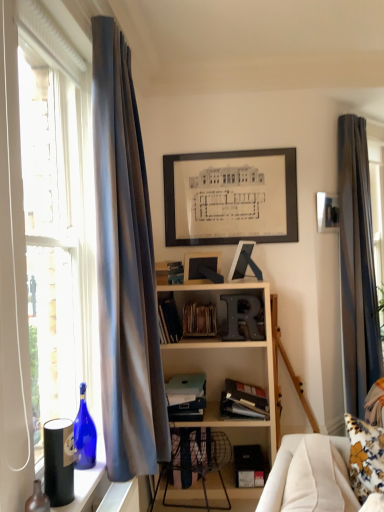
What do you see at coordinates (169, 272) in the screenshot?
I see `matte blue book at center, the 5th book ordered from the bottom` at bounding box center [169, 272].

Describe the element at coordinates (168, 321) in the screenshot. I see `hardcover book at center, which is counted as the 3th book, starting from the top` at that location.

The image size is (384, 512). I want to click on hardcover book at center, the 2th book from the bottom, so click(244, 400).

The height and width of the screenshot is (512, 384). Describe the element at coordinates (244, 400) in the screenshot. I see `hardcover book at center, the 2th book from the bottom` at that location.

Find the location of a particular element. This screenshot has width=384, height=512. matte black book at center, the fifth book positioned from the top is located at coordinates pos(186,397).

You are a GUI agent. You are given a task and a screenshot of the screen. Output one action in this format:
    pyautogui.click(x=<x>, y=<y>)
    Task: Click on the matte glass bottle at lower left, the 1th bottle positioned from the front
    The width and height of the screenshot is (384, 512).
    Given the screenshot: What is the action you would take?
    pyautogui.click(x=37, y=500)

From a real-world perspective, between satin blue curtain at left, which is counted as the second curtain, starting from the right, and wooden spines at center, which ranks as the second book in top-to-bottom order, who is vertically higher?

satin blue curtain at left, which is counted as the second curtain, starting from the right, from a real-world perspective.

Does satin blue curtain at left, the first curtain when ordered from front to back, have a greater height compared to wooden spines at center, placed as the 4th book when sorted from bottom to top?

Yes, satin blue curtain at left, the first curtain when ordered from front to back, is taller than wooden spines at center, placed as the 4th book when sorted from bottom to top.

From the image's perspective, relative to wooden spines at center, which ranks as the second book in top-to-bottom order, is satin blue curtain at left, the first curtain when ordered from front to back, above or below?

From the image's perspective, satin blue curtain at left, the first curtain when ordered from front to back, appears above wooden spines at center, which ranks as the second book in top-to-bottom order.

Is satin blue curtain at left, which is counted as the second curtain, starting from the back, facing towards wooden spines at center, which ranks as the second book in top-to-bottom order?

No, satin blue curtain at left, which is counted as the second curtain, starting from the back, is not aimed at wooden spines at center, which ranks as the second book in top-to-bottom order.

Considering the relative positions of hardcover book at center, the 2th book from the bottom, and matte blue book at center, the 5th book ordered from the bottom, in the image provided, is hardcover book at center, the 2th book from the bottom, to the left or to the right of matte blue book at center, the 5th book ordered from the bottom,?

Based on their positions, hardcover book at center, the 2th book from the bottom, is located to the right of matte blue book at center, the 5th book ordered from the bottom.

Consider the image. What's the angular difference between hardcover book at center, acting as the fourth book starting from the top, and matte blue book at center, the 1th book from the top,'s facing directions?

There is a 51-degree angle between the facing directions of hardcover book at center, acting as the fourth book starting from the top, and matte blue book at center, the 1th book from the top.

Would you say hardcover book at center, acting as the fourth book starting from the top, is inside or outside matte blue book at center, the 1th book from the top?

The correct answer is: outside.

Which is nearer, [262,411] or [176,274]?

The point [262,411] is more forward.

Considering the relative positions of hardcover book at center, the 3th book from the bottom, and silky blue curtain at right, acting as the first curtain starting from the back, in the image provided, is hardcover book at center, the 3th book from the bottom, to the right of silky blue curtain at right, acting as the first curtain starting from the back, from the viewer's perspective?

Incorrect, hardcover book at center, the 3th book from the bottom, is not on the right side of silky blue curtain at right, acting as the first curtain starting from the back.

Is hardcover book at center, which is counted as the 3th book, starting from the top, far from silky blue curtain at right, which is counted as the second curtain, starting from the left?

Yes, hardcover book at center, which is counted as the 3th book, starting from the top, and silky blue curtain at right, which is counted as the second curtain, starting from the left, are located far from each other.

From the image's perspective, which is below, hardcover book at center, the 3th book from the bottom, or silky blue curtain at right, which is counted as the second curtain, starting from the left?

hardcover book at center, the 3th book from the bottom, appears lower in the image.

How far apart are hardcover book at center, the 3th book from the bottom, and silky blue curtain at right, acting as the 1th curtain starting from the right?

The distance of hardcover book at center, the 3th book from the bottom, from silky blue curtain at right, acting as the 1th curtain starting from the right, is 4.94 feet.

Would you say matte black picture frame at center, positioned as the 3th picture frame in back-to-front order, is to the left or to the right of satin blue curtain at left, which is counted as the second curtain, starting from the right, in the picture?

Based on their positions, matte black picture frame at center, positioned as the 3th picture frame in back-to-front order, is located to the right of satin blue curtain at left, which is counted as the second curtain, starting from the right.

Based on their sizes in the image, would you say matte black picture frame at center, arranged as the third picture frame when viewed from the right, is bigger or smaller than satin blue curtain at left, which is counted as the second curtain, starting from the right?

matte black picture frame at center, arranged as the third picture frame when viewed from the right, is smaller than satin blue curtain at left, which is counted as the second curtain, starting from the right.

Considering the relative positions of matte black picture frame at center, which is the first picture frame in front-to-back order, and satin blue curtain at left, which is counted as the second curtain, starting from the back, in the image provided, is matte black picture frame at center, which is the first picture frame in front-to-back order, behind satin blue curtain at left, which is counted as the second curtain, starting from the back,?

Yes, matte black picture frame at center, which is the first picture frame in front-to-back order, is further from the camera.

From a real-world perspective, which is physically below, matte black picture frame at center, positioned as the 3th picture frame in back-to-front order, or satin blue curtain at left, which is counted as the second curtain, starting from the back?

matte black picture frame at center, positioned as the 3th picture frame in back-to-front order, is physically lower.

Would you say matte glass bottle at lower left, which appears as the 2th bottle when viewed from the back, is a long distance from satin blue curtain at left, which is counted as the second curtain, starting from the right?

No, matte glass bottle at lower left, which appears as the 2th bottle when viewed from the back, is not far from satin blue curtain at left, which is counted as the second curtain, starting from the right.

Is point (26, 506) closer to viewer compared to point (114, 175)?

Yes.

From the image's perspective, which is below, matte glass bottle at lower left, which appears as the 2th bottle when viewed from the back, or satin blue curtain at left, which is counted as the second curtain, starting from the right?

matte glass bottle at lower left, which appears as the 2th bottle when viewed from the back.

Which of these two, matte silver picture frame at upper right, the 3th picture frame from the bottom, or hardcover book at center, the 2th book from the bottom, is thinner?

matte silver picture frame at upper right, the 3th picture frame from the bottom.

Which of these two, matte silver picture frame at upper right, the 3th picture frame from the bottom, or hardcover book at center, acting as the fourth book starting from the top, stands shorter?

Standing shorter between the two is hardcover book at center, acting as the fourth book starting from the top.

Consider the image. From a real-world perspective, is matte silver picture frame at upper right, the 3th picture frame viewed from the front, over hardcover book at center, acting as the fourth book starting from the top?

Indeed, from a real-world perspective, matte silver picture frame at upper right, the 3th picture frame viewed from the front, stands above hardcover book at center, acting as the fourth book starting from the top.

Locate an element on the screen. the 5th book in front of the matte silver picture frame at upper right, the 3th picture frame viewed from the left, starting your count from the anchor is located at coordinates (244, 400).

Is matte black book at center, the fifth book positioned from the top, a part of silky blue curtain at right, which is counted as the second curtain, starting from the left?

No, matte black book at center, the fifth book positioned from the top, is not a part of silky blue curtain at right, which is counted as the second curtain, starting from the left.

Between silky blue curtain at right, acting as the first curtain starting from the back, and matte black book at center, marked as the 1th book in a bottom-to-top arrangement, which one has smaller size?

Smaller between the two is matte black book at center, marked as the 1th book in a bottom-to-top arrangement.

Does silky blue curtain at right, acting as the 1th curtain starting from the right, have a lesser width compared to matte black book at center, the fifth book positioned from the top?

Correct, the width of silky blue curtain at right, acting as the 1th curtain starting from the right, is less than that of matte black book at center, the fifth book positioned from the top.

Is matte black book at center, the fifth book positioned from the top, at the back of silky blue curtain at right, acting as the first curtain starting from the back?

silky blue curtain at right, acting as the first curtain starting from the back, is not turned away from matte black book at center, the fifth book positioned from the top.

From a real-world perspective, starting from the satin blue curtain at left, which is counted as the second curtain, starting from the right, which book is the 2nd one below it? Please provide its 2D coordinates.

[(199, 320)]

I want to click on the 4th book in front of the matte blue book at center, the 1th book from the top, starting your count from the anchor, so click(x=244, y=400).

Looking at the image, which one is located closer to satin blue curtain at left, which is counted as the second curtain, starting from the right, silky blue curtain at right, acting as the first curtain starting from the back, or matte black picture frame at center, arranged as the third picture frame when viewed from the right?

matte black picture frame at center, arranged as the third picture frame when viewed from the right.

Looking at the image, which one is located closer to matte blue book at center, the 1th book from the top, hardcover book at center, the 2th book from the bottom, or hardcover book at center, which is counted as the 3th book, starting from the top?

hardcover book at center, which is counted as the 3th book, starting from the top, is positioned closer to the anchor matte blue book at center, the 1th book from the top.

Estimate the real-world distances between objects in this image. Which object is further from silky blue curtain at right, which is the 2th curtain from front to back, matte blue book at center, the 1th book from the top, or blue glass bottle at window, which is counted as the 2th bottle, starting from the front?

The object further to silky blue curtain at right, which is the 2th curtain from front to back, is blue glass bottle at window, which is counted as the 2th bottle, starting from the front.

Which object lies nearer to the anchor point hardcover book at center, the 3th book from the bottom, matte silver picture frame at upper right, which ranks as the 1th picture frame in back-to-front order, or matte blue book at center, the 5th book ordered from the bottom?

matte blue book at center, the 5th book ordered from the bottom, is positioned closer to the anchor hardcover book at center, the 3th book from the bottom.

Estimate the real-world distances between objects in this image. Which object is further from matte black book at center, marked as the 1th book in a bottom-to-top arrangement, matte silver picture frame at upper right, the 3th picture frame from the bottom, or silky blue curtain at right, which is the 2th curtain from front to back?

Among the two, matte silver picture frame at upper right, the 3th picture frame from the bottom, is located further to matte black book at center, marked as the 1th book in a bottom-to-top arrangement.

From the picture: Which object lies further to the anchor point matte black picture frame at center, which is the first picture frame in front-to-back order, matte black book at center, marked as the 1th book in a bottom-to-top arrangement, or matte blue book at center, the 1th book from the top?

Among the two, matte black book at center, marked as the 1th book in a bottom-to-top arrangement, is located further to matte black picture frame at center, which is the first picture frame in front-to-back order.

Which object lies further to the anchor point satin blue curtain at left, the first curtain when ordered from front to back, matte glass bottle at lower left, which appears as the 2th bottle when viewed from the back, or silky blue curtain at right, which is counted as the second curtain, starting from the left?

silky blue curtain at right, which is counted as the second curtain, starting from the left, is further to satin blue curtain at left, the first curtain when ordered from front to back.

From the image, which object appears to be nearer to matte silver picture frame at upper right, the 3th picture frame viewed from the front, matte black book at center, the fifth book positioned from the top, or matte black picture frame at upper center, which is counted as the 2th picture frame, starting from the left?

The object closer to matte silver picture frame at upper right, the 3th picture frame viewed from the front, is matte black picture frame at upper center, which is counted as the 2th picture frame, starting from the left.

The height and width of the screenshot is (512, 384). In order to click on picture frame between matte glass bottle at lower left, the 1th bottle positioned from the front, and hardcover book at center, the 2th book from the bottom, from front to back in this screenshot , I will do pyautogui.click(x=201, y=267).

You are a GUI agent. You are given a task and a screenshot of the screen. Output one action in this format:
    pyautogui.click(x=<x>, y=<y>)
    Task: Click on the book between matte blue book at center, the 1th book from the top, and hardcover book at center, the 3th book from the bottom, in the vertical direction
    
    Given the screenshot: What is the action you would take?
    pyautogui.click(x=199, y=320)

Locate an element on the screen. The image size is (384, 512). curtain between matte glass bottle at lower left, the 1th bottle positioned from the front, and hardcover book at center, the 3th book from the bottom, from front to back is located at coordinates (125, 269).

Where is `curtain situated between blue glass bottle at window, the 1th bottle from the back, and silky blue curtain at right, acting as the first curtain starting from the back, from left to right`? This screenshot has height=512, width=384. curtain situated between blue glass bottle at window, the 1th bottle from the back, and silky blue curtain at right, acting as the first curtain starting from the back, from left to right is located at coordinates (125, 269).